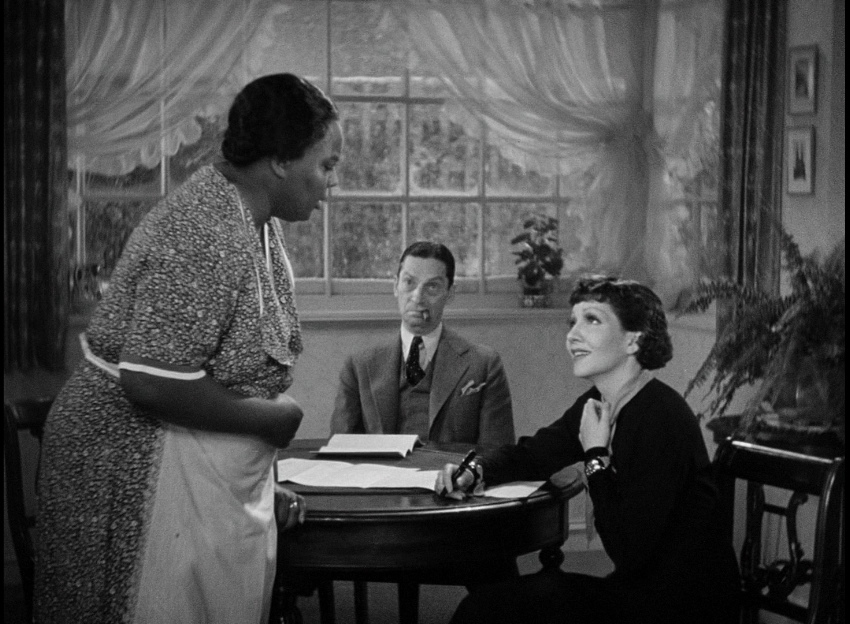
Identify the location of window. (388, 193).